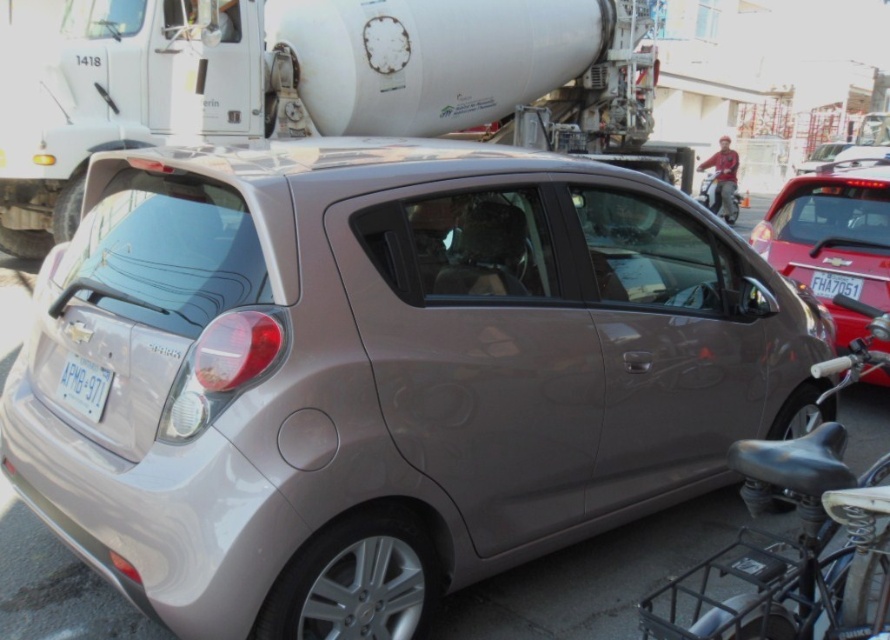
Does satin metallic hatchback at center have a smaller size compared to satin gold hatchback at center?

Correct, satin metallic hatchback at center occupies less space than satin gold hatchback at center.

Who is positioned more to the right, satin metallic hatchback at center or satin gold hatchback at center?

From the viewer's perspective, satin gold hatchback at center appears more on the right side.

Is point (223, 592) closer to camera compared to point (808, 168)?

Yes, it is.

The image size is (890, 640). I want to click on satin metallic hatchback at center, so click(x=385, y=372).

Is the position of white plastic license plate at lower left less distant than that of white plastic license plate at center?

Yes, white plastic license plate at lower left is in front of white plastic license plate at center.

Which is in front, point (81, 384) or point (846, 275)?

Point (81, 384) is in front.

Is point (103, 392) positioned before point (850, 288)?

That is True.

Identify the location of white plastic license plate at lower left. The image size is (890, 640). (85, 387).

Consider the image. Is white plastic license plate at lower left to the right of satin gold hatchback at center from the viewer's perspective?

No, white plastic license plate at lower left is not to the right of satin gold hatchback at center.

Can you confirm if white plastic license plate at lower left is bigger than satin gold hatchback at center?

No.

You are a GUI agent. You are given a task and a screenshot of the screen. Output one action in this format:
    pyautogui.click(x=<x>, y=<y>)
    Task: Click on the white plastic license plate at lower left
    The height and width of the screenshot is (640, 890).
    Given the screenshot: What is the action you would take?
    pyautogui.click(x=85, y=387)